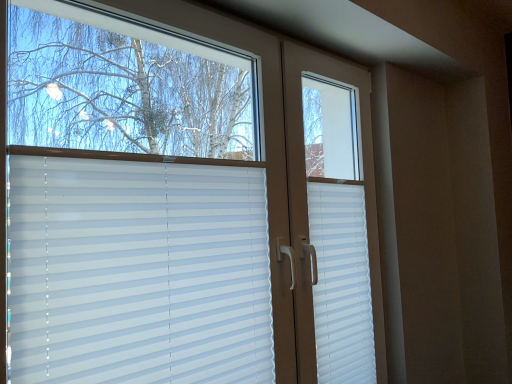
Question: Is white plastic shutter at right smaller than white plastic blinds at center?

Choices:
 (A) no
 (B) yes

Answer: (B)

Question: From a real-world perspective, is white plastic shutter at right positioned under white plastic blinds at center based on gravity?

Choices:
 (A) no
 (B) yes

Answer: (B)

Question: Is white plastic shutter at right to the right of white plastic blinds at center from the viewer's perspective?

Choices:
 (A) no
 (B) yes

Answer: (B)

Question: Is white plastic blinds at center surrounded by white plastic shutter at right?

Choices:
 (A) yes
 (B) no

Answer: (B)

Question: Is white plastic shutter at right behind white plastic blinds at center?

Choices:
 (A) yes
 (B) no

Answer: (A)

Question: From the image's perspective, is white plastic shutter at right located beneath white plastic blinds at center?

Choices:
 (A) yes
 (B) no

Answer: (A)

Question: Is white plastic blinds at center positioned beyond the bounds of white plastic shutter at right?

Choices:
 (A) no
 (B) yes

Answer: (B)

Question: Considering the relative sizes of white plastic blinds at center and white plastic shutter at right in the image provided, is white plastic blinds at center thinner than white plastic shutter at right?

Choices:
 (A) yes
 (B) no

Answer: (B)

Question: Is white plastic blinds at center aimed at white plastic shutter at right?

Choices:
 (A) no
 (B) yes

Answer: (A)

Question: Is white plastic blinds at center looking in the opposite direction of white plastic shutter at right?

Choices:
 (A) no
 (B) yes

Answer: (A)

Question: Considering the relative sizes of white plastic blinds at center and white plastic shutter at right in the image provided, is white plastic blinds at center bigger than white plastic shutter at right?

Choices:
 (A) no
 (B) yes

Answer: (B)

Question: From the image's perspective, is white plastic blinds at center under white plastic shutter at right?

Choices:
 (A) yes
 (B) no

Answer: (B)

Question: Is the depth of white plastic blinds at center greater than that of white plastic blinds at center?

Choices:
 (A) yes
 (B) no

Answer: (A)